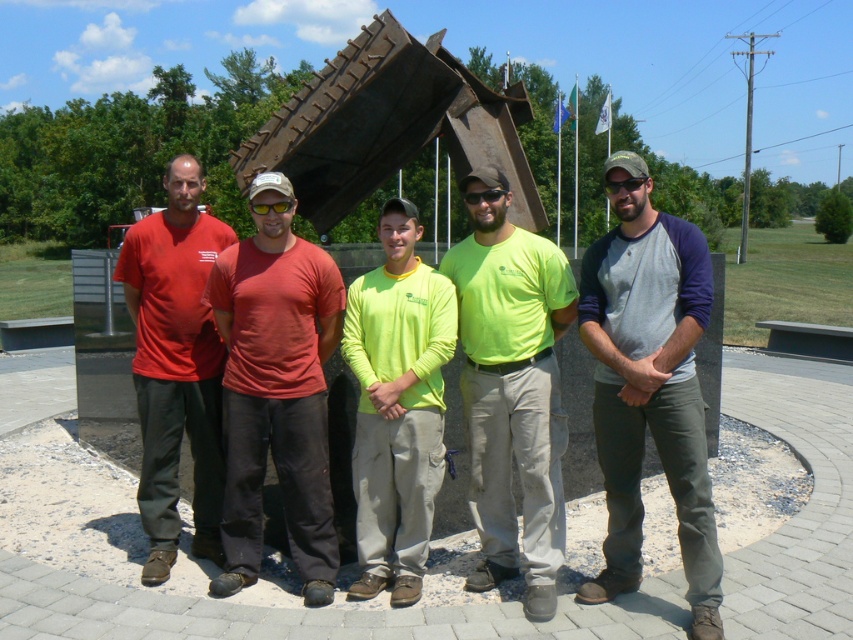
Question: Is dark brown metal sculpture at center bigger than neon yellow long-sleeve shirt at center?

Choices:
 (A) yes
 (B) no

Answer: (A)

Question: Which object is the farthest from the matte red t-shirt at center?

Choices:
 (A) dark brown metal sculpture at center
 (B) neon yellow long-sleeve shirt at center

Answer: (A)

Question: Is neon green t-shirt at center to the left of neon yellow long-sleeve shirt at center from the viewer's perspective?

Choices:
 (A) no
 (B) yes

Answer: (A)

Question: Which point is closer to the camera?

Choices:
 (A) (387, 342)
 (B) (503, 136)

Answer: (A)

Question: Which object is the closest to the matte red t-shirt at center?

Choices:
 (A) gray cotton t-shirt at center
 (B) neon green t-shirt at center
 (C) matte red t-shirt at left
 (D) neon yellow long-sleeve shirt at center

Answer: (D)

Question: Can you confirm if matte red t-shirt at center is smaller than matte red t-shirt at left?

Choices:
 (A) yes
 (B) no

Answer: (B)